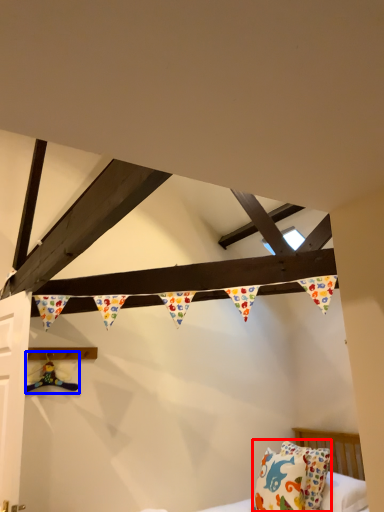
Question: Which point is closer to the camera, pillow (highlighted by a red box) or toy (highlighted by a blue box)?

Choices:
 (A) pillow
 (B) toy

Answer: (A)